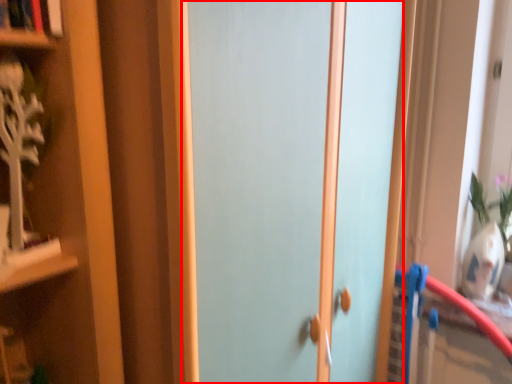
Question: From the image's perspective, what is the correct spatial positioning of door (annotated by the red box) in reference to book?

Choices:
 (A) below
 (B) above

Answer: (A)